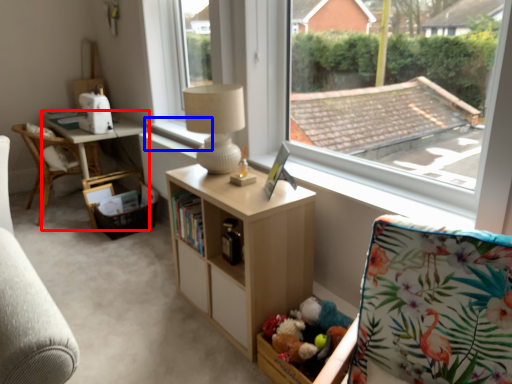
Question: Which of the following is the closest to the observer, table (highlighted by a red box) or window sill (highlighted by a blue box)?

Choices:
 (A) table
 (B) window sill

Answer: (B)